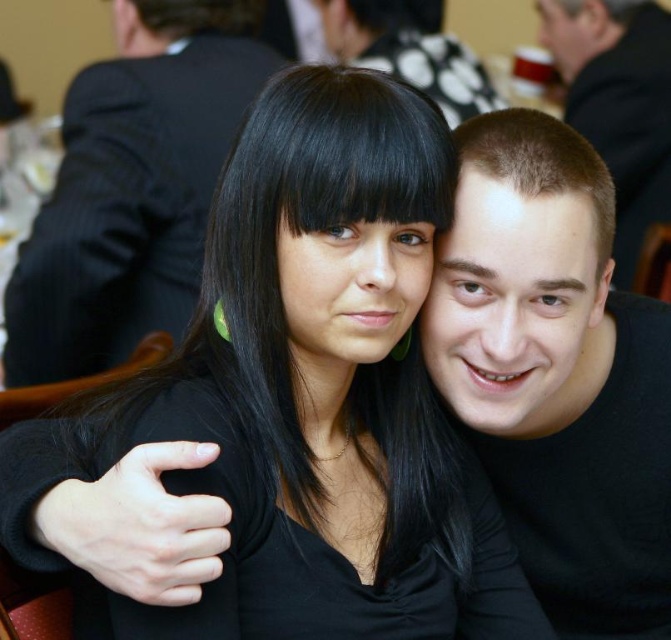
You are a photographer adjusting your camera settings to capture a group photo. You notice the black matte shirt at center and the black matte suit at upper left in your frame. Which object should you focus on first if you want to ensure the wider one is in sharp focus?

The black matte suit at upper left is wider than the black matte shirt at center, so you should focus on the black matte suit at upper left first to ensure it is in sharp focus.

Based on the photo, you are a photographer setting up for a group photo. You notice two people wearing black shirts at the center of the scene. Based on their clothing, which of the two black shirts at center could potentially allow for a more flattering fit for a wider torso? Please choose between the black matte shirt at center and the smooth black shirt at center.

The black matte shirt at center might be wider than the smooth black shirt at center, so the black matte shirt at center could provide a more flattering fit for someone with a wider torso.

You are a photographer adjusting your camera to focus on the person on the right. The focus point of your camera is currently at point (558, 372). Is this focus point likely to be on the black matte shirt at center?

Yes, the point (558, 372) corresponds to the black matte shirt at center, so the focus point is likely on the black matte shirt at center.